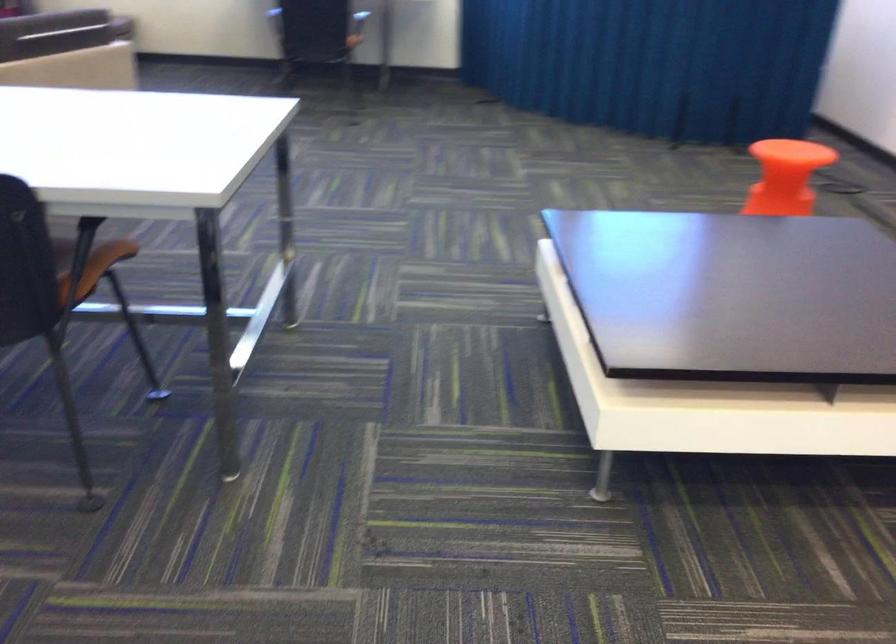
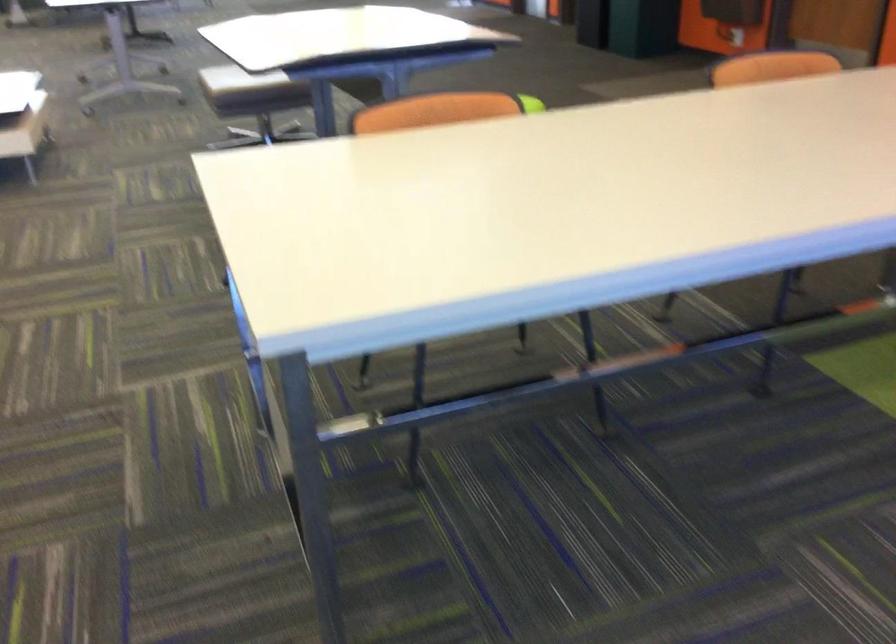
Locate, in the second image, the point that corresponds to (75,128) in the first image.

(492, 189)